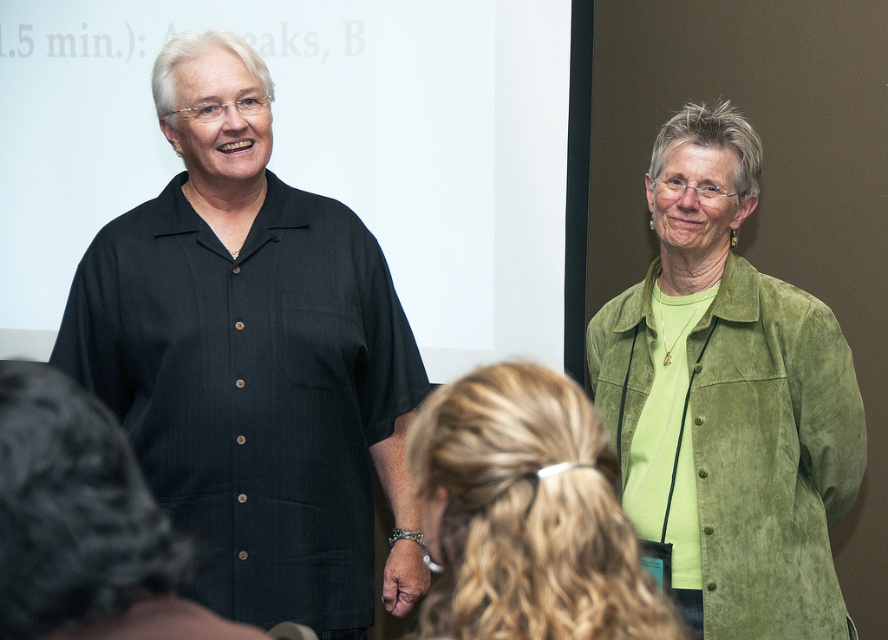
Question: Which object is the closest to the green suede jacket at center?

Choices:
 (A) green suede jacket at upper right
 (B) black button-down shirt at left
 (C) green suede shirt at right

Answer: (B)

Question: Which is nearer to the green suede shirt at right?

Choices:
 (A) green suede jacket at upper right
 (B) green suede jacket at center
 (C) black button-down shirt at left

Answer: (A)

Question: Does green suede jacket at upper right appear under green suede shirt at right?

Choices:
 (A) yes
 (B) no

Answer: (B)

Question: Does green suede jacket at center appear on the right side of green suede shirt at right?

Choices:
 (A) yes
 (B) no

Answer: (B)

Question: Which point is closer to the camera?

Choices:
 (A) (662, 609)
 (B) (734, 481)
 (C) (656, 339)

Answer: (A)

Question: Can you confirm if green suede jacket at upper right is wider than green suede jacket at center?

Choices:
 (A) no
 (B) yes

Answer: (B)